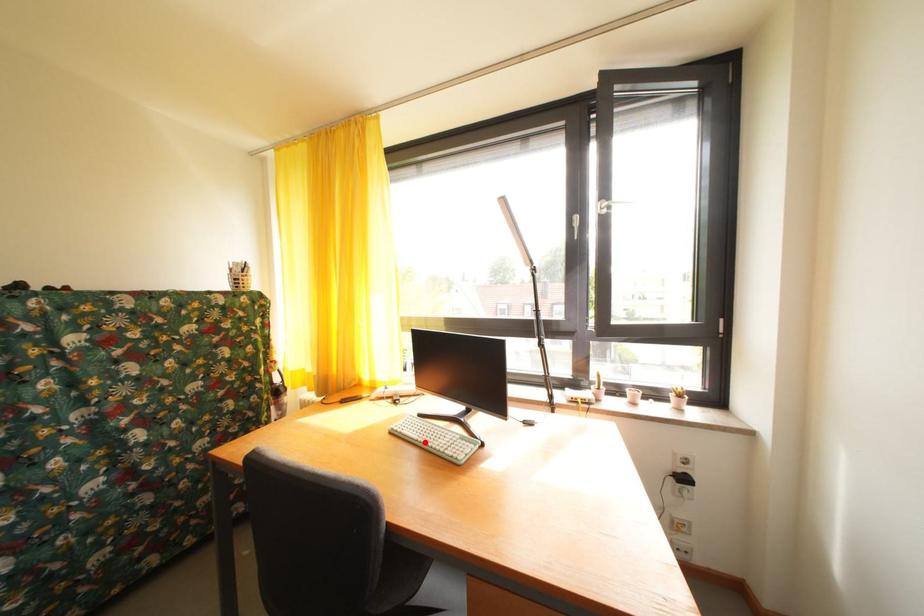
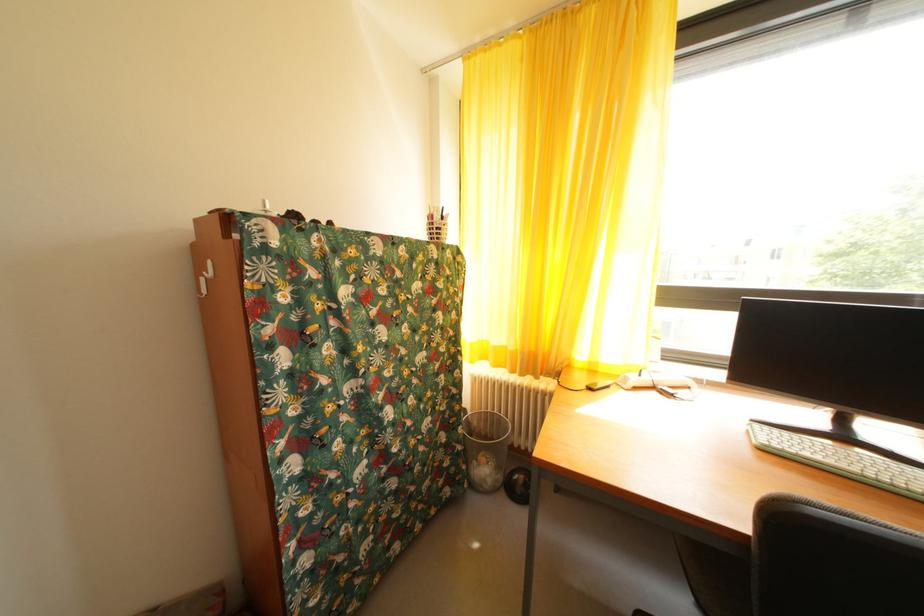
In the second image, find the point that corresponds to the highlighted location in the first image.

(854, 472)